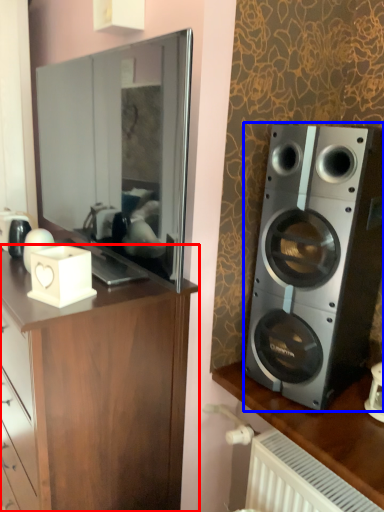
Question: Which object appears farthest to the camera in this image, cabinetry (highlighted by a red box) or speaker (highlighted by a blue box)?

Choices:
 (A) cabinetry
 (B) speaker

Answer: (B)